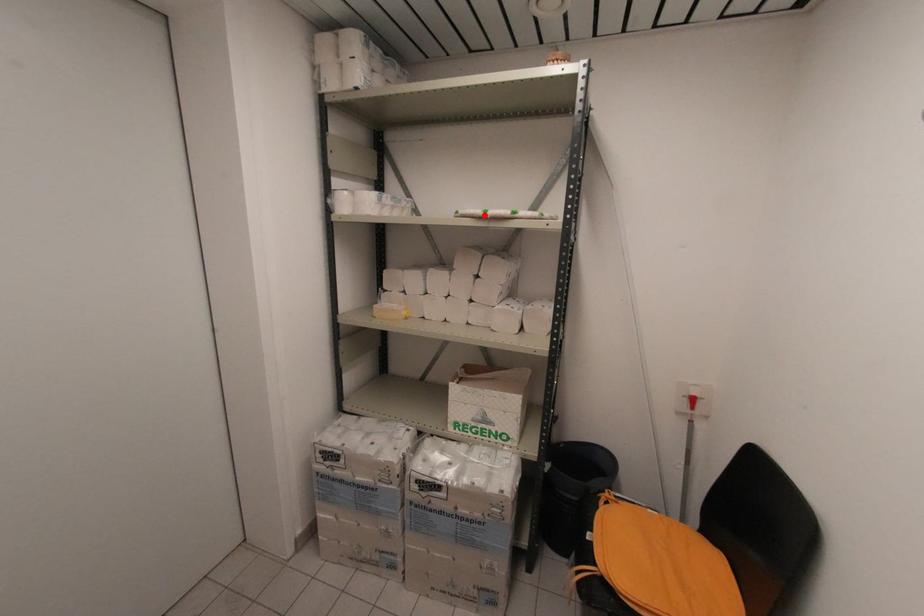
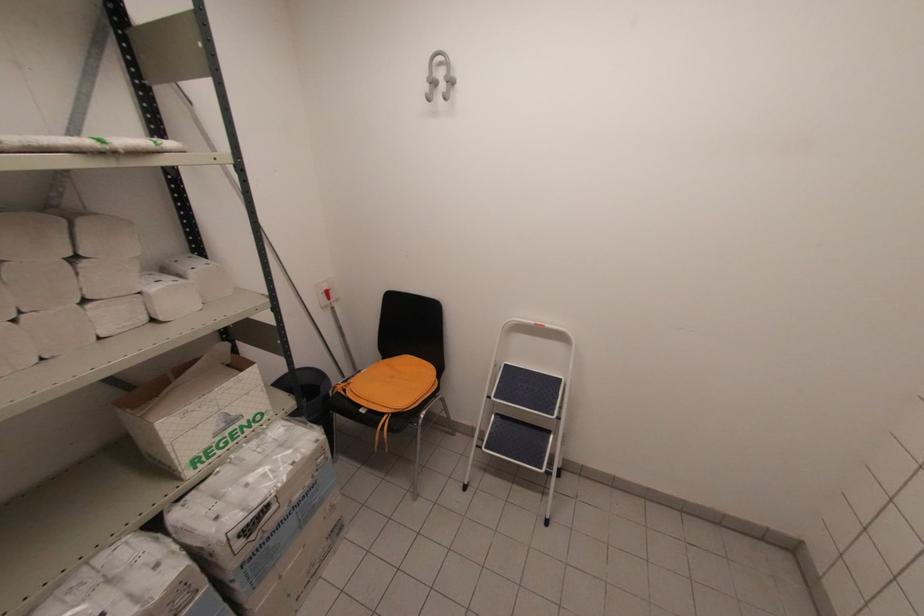
In the second image, find the point that corresponds to the highlighted location in the first image.

(107, 148)